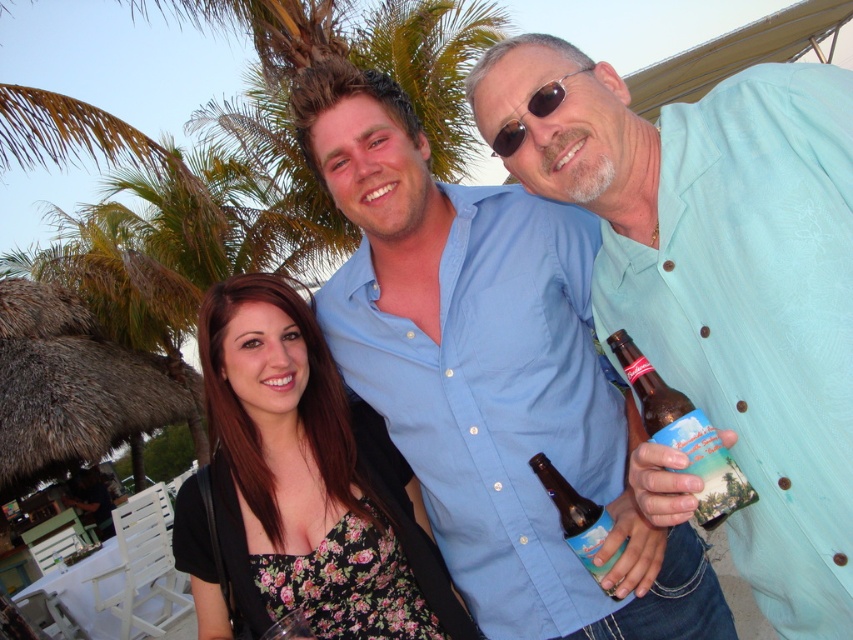
Question: Which is nearer to the light blue shirt at center?

Choices:
 (A) blue cotton shirt at center
 (B) floral fabric dress at center
 (C) brown glass bottle at center

Answer: (A)

Question: Does floral fabric dress at center lie in front of sunglasses at center?

Choices:
 (A) no
 (B) yes

Answer: (A)

Question: Is brown glass bottle at center-right above sunglasses at center?

Choices:
 (A) no
 (B) yes

Answer: (A)

Question: Estimate the real-world distances between objects in this image. Which object is farther from the brown glass bottle at center?

Choices:
 (A) light blue shirt at center
 (B) sunglasses at center

Answer: (B)

Question: Which point is closer to the camera taking this photo?

Choices:
 (A) (608, 557)
 (B) (560, 102)
 (C) (631, 371)

Answer: (C)

Question: Can you confirm if floral fabric dress at center is wider than brown glass bottle at center?

Choices:
 (A) yes
 (B) no

Answer: (A)